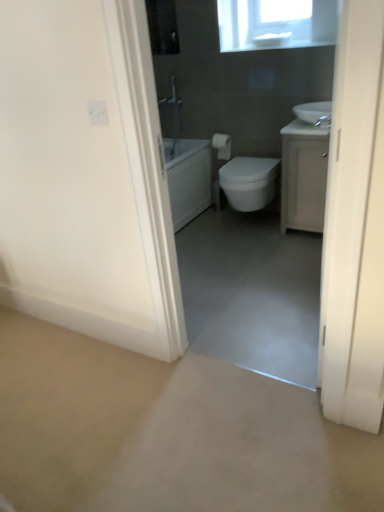
Question: From the image's perspective, relative to white matte toilet paper at center, is smooth concrete floor at center above or below?

Choices:
 (A) above
 (B) below

Answer: (B)

Question: Considering the positions of smooth concrete floor at center and white matte toilet paper at center in the image, is smooth concrete floor at center wider or thinner than white matte toilet paper at center?

Choices:
 (A) wide
 (B) thin

Answer: (A)

Question: Which of these objects is positioned closest to the white glossy cabinet at right?

Choices:
 (A) smooth concrete floor at center
 (B) white glossy bidet at center
 (C) white matte toilet paper at center
 (D) white glossy sink at upper right

Answer: (B)

Question: Estimate the real-world distances between objects in this image. Which object is farther from the white glossy bidet at center?

Choices:
 (A) white matte toilet paper at center
 (B) white glossy sink at upper right
 (C) white glossy cabinet at right
 (D) smooth concrete floor at center

Answer: (D)